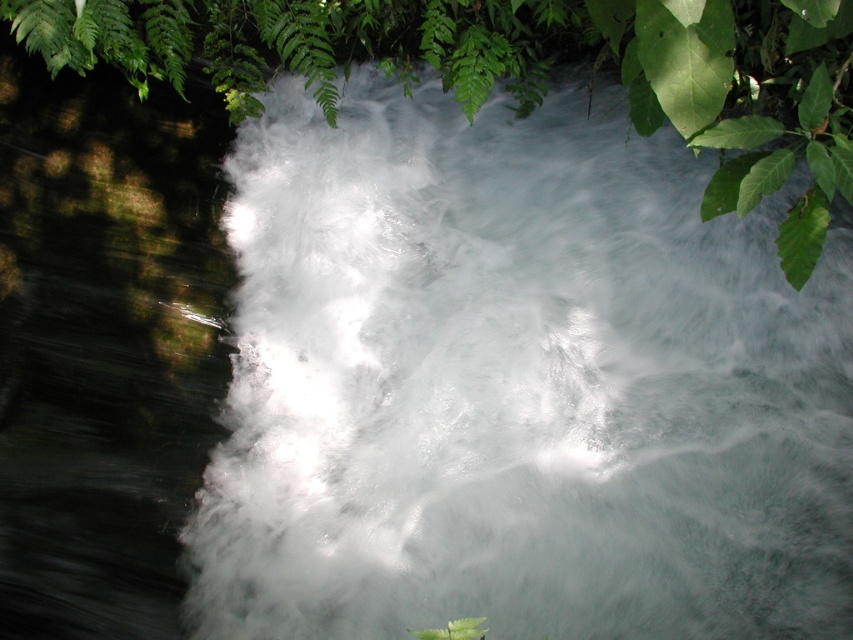
You are standing at the edge of the flowing river and see two points marked in the scene. If you want to reach both points by walking along the riverbank, which point would you reach first, the point at coordinates [213,61] or the point at [691,131]?

You will reach the point at coordinates [213,61] first because it is closer to you than the point at [691,131], which is further away.

In the scene shown: You are a bird flying over the flowing river. You see the green leafy tree at upper center and the green matte leaf at upper right. Which object is higher in the scene?

The green leafy tree at upper center is higher than the green matte leaf at upper right because it is positioned above it in the scene.

You are a bird flying over the flowing river. You see the green leafy tree at upper center and the green matte leaf at upper right. Which object would you need to fly over first to reach the opposite bank?

The green leafy tree at upper center is larger in size than the green matte leaf at upper right, so you would need to fly over the green leafy tree at upper center first to reach the opposite bank.